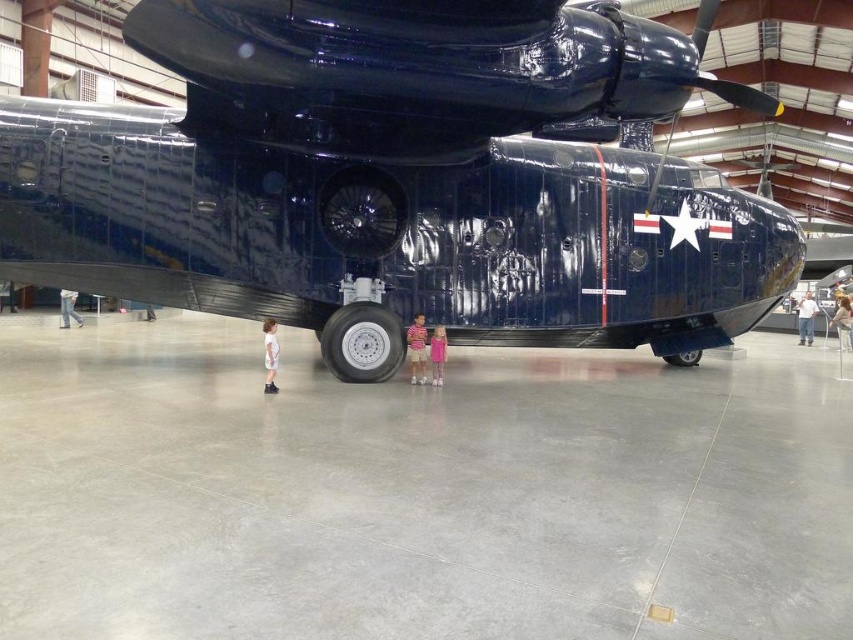
You are a photographer trying to capture the aircraft in the hangar. You notice a point at coordinates [270,355] on the image. Based on the scene description, what object or feature is located at this point?

The point at coordinates [270,355] is on the pink fabric dress at lower center, which belongs to the child closest to the camera wearing a pink outfit.